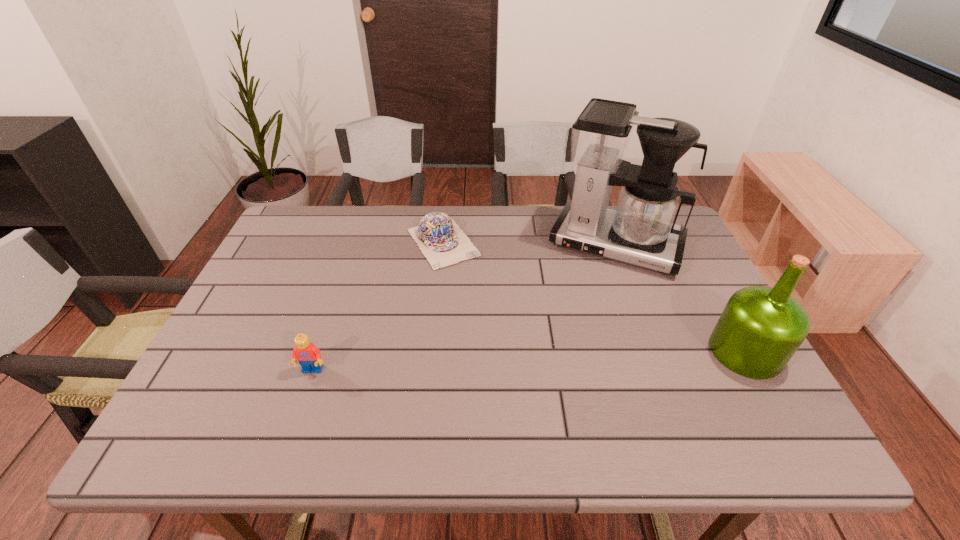
At what (x,y) coordinates should I click in order to perform the action: click on object that is at the far right corner. Please return your answer as a coordinate pair (x, y). The height and width of the screenshot is (540, 960). Looking at the image, I should click on coord(641,231).

The height and width of the screenshot is (540, 960). In order to click on object that is positioned at the near right corner in this screenshot , I will do `click(760, 329)`.

The width and height of the screenshot is (960, 540). In order to click on vacant space at the far edge of the desktop in this screenshot , I will do `click(541, 238)`.

Locate an element on the screen. free space at the near edge is located at coordinates (588, 400).

Locate an element on the screen. This screenshot has height=540, width=960. vacant area at the left edge of the desktop is located at coordinates (243, 314).

You are a GUI agent. You are given a task and a screenshot of the screen. Output one action in this format:
    pyautogui.click(x=<x>, y=<y>)
    Task: Click on the vacant space at the right edge of the desktop
    
    Given the screenshot: What is the action you would take?
    pyautogui.click(x=698, y=305)

Where is `vacant area between the shortest object and the olive oil`? The height and width of the screenshot is (540, 960). vacant area between the shortest object and the olive oil is located at coordinates (594, 297).

Locate an element on the screen. This screenshot has height=540, width=960. free space between the olive oil and the second shortest object is located at coordinates (529, 361).

Locate an element on the screen. This screenshot has width=960, height=540. vacant area that lies between the shortest object and the third shortest object is located at coordinates (594, 297).

Where is `free spot between the olive oil and the shortest object`? This screenshot has width=960, height=540. free spot between the olive oil and the shortest object is located at coordinates [594, 297].